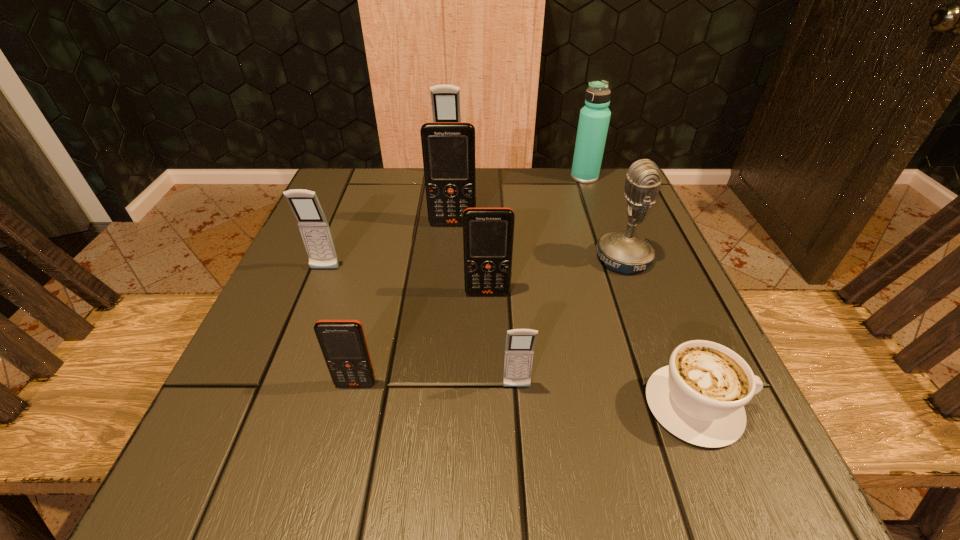
Image resolution: width=960 pixels, height=540 pixels. Find the location of `object that is at the far right corner`. object that is at the far right corner is located at coordinates (594, 118).

Where is `object at the near right corner`? Image resolution: width=960 pixels, height=540 pixels. object at the near right corner is located at coordinates (699, 397).

In the image, there is a desktop. Identify the location of vacant area at the far edge. This screenshot has width=960, height=540. (522, 180).

The image size is (960, 540). Identify the location of vacant space at the near edge of the desktop. (375, 475).

In the image, there is a desktop. At what (x,y) coordinates should I click in order to perform the action: click on vacant space at the left edge. Please return your answer as a coordinate pair (x, y). Image resolution: width=960 pixels, height=540 pixels. Looking at the image, I should click on (289, 275).

The height and width of the screenshot is (540, 960). In order to click on vacant space at the right edge in this screenshot , I will do `click(662, 269)`.

Where is `free space at the far left corner`? The image size is (960, 540). free space at the far left corner is located at coordinates (368, 194).

Where is `blank area at the near right corner`? The height and width of the screenshot is (540, 960). blank area at the near right corner is located at coordinates (644, 464).

This screenshot has width=960, height=540. What are the coordinates of `vacant space in between the sixth farthest object and the third farthest cellular telephone` in the screenshot? It's located at (406, 281).

Find the location of a particular element. free spot between the rightmost gray cellular telephone and the third nearest cellular telephone is located at coordinates coord(502,340).